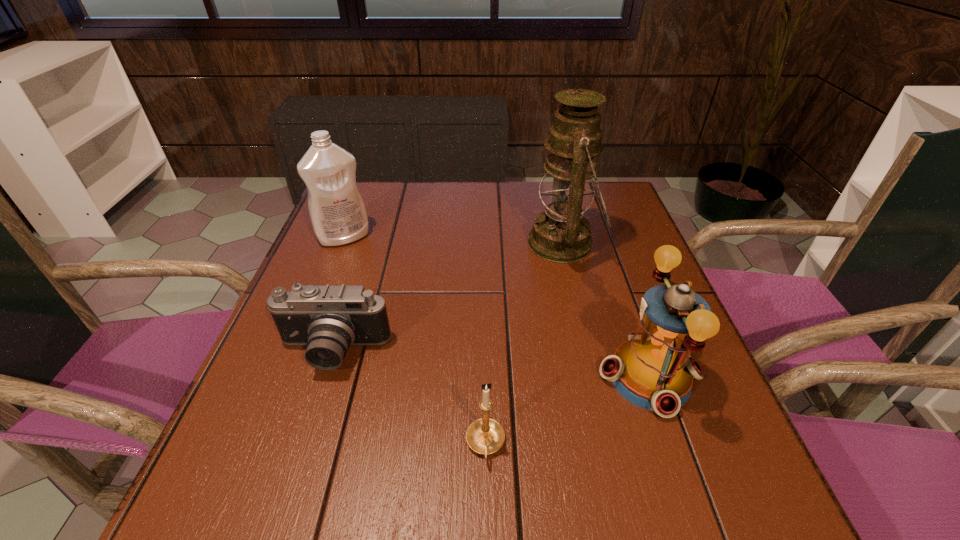
The height and width of the screenshot is (540, 960). I want to click on vacant space located on the handle side of the third object from left to right, so click(x=487, y=532).

Locate an element on the screen. The height and width of the screenshot is (540, 960). vacant space located on the front-facing side of the camera is located at coordinates (290, 487).

The height and width of the screenshot is (540, 960). I want to click on oil lamp at the far edge, so click(x=562, y=234).

I want to click on detergent present at the far edge, so click(x=337, y=212).

The image size is (960, 540). What are the coordinates of `detergent that is at the left edge` in the screenshot? It's located at (337, 212).

This screenshot has height=540, width=960. What are the coordinates of `camera located at the left edge` in the screenshot? It's located at (x=327, y=319).

You are a GUI agent. You are given a task and a screenshot of the screen. Output one action in this format:
    pyautogui.click(x=<x>, y=<y>)
    Task: Click on the oil lamp that is at the right edge
    This screenshot has width=960, height=540.
    Given the screenshot: What is the action you would take?
    pyautogui.click(x=562, y=234)

Find the location of a particular element. This screenshot has width=960, height=540. lantern positioned at the right edge is located at coordinates (653, 370).

Find the location of a particular element. object that is positioned at the far left corner is located at coordinates (337, 212).

In order to click on object that is at the far right corner in this screenshot , I will do `click(562, 234)`.